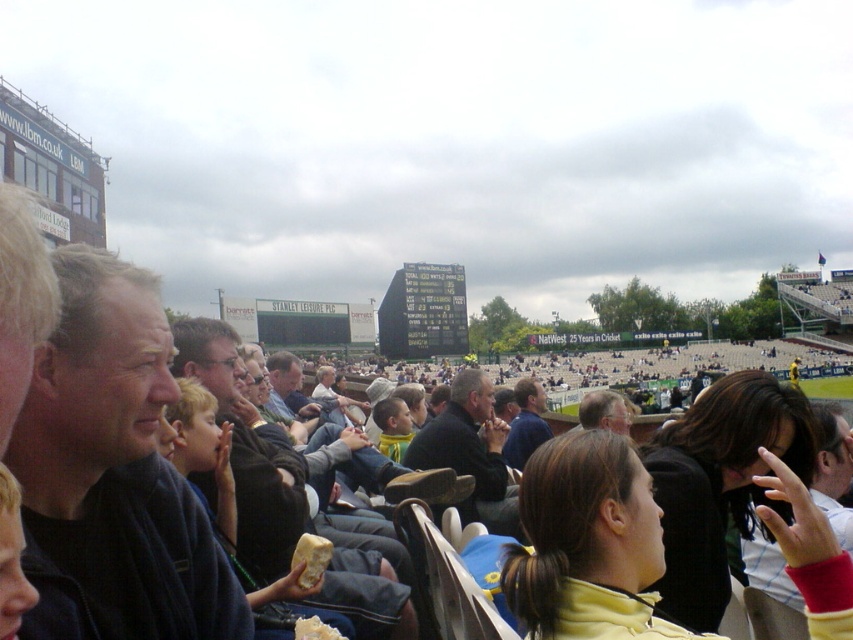
Question: Is matte black jacket at center in front of yellow crumbly food at center?

Choices:
 (A) no
 (B) yes

Answer: (A)

Question: Which point is farther from the camera taking this photo?

Choices:
 (A) (90, 628)
 (B) (753, 419)

Answer: (B)

Question: Where is dark blue fleece at center located in relation to matte black jacket at center in the image?

Choices:
 (A) right
 (B) left

Answer: (B)

Question: Based on their relative distances, which object is farther from the dark blue fleece at center?

Choices:
 (A) dark brown hair at center
 (B) dark blue sweater at center
 (C) yellow crumbly food at center
 (D) dark brown leather jacket at center

Answer: (A)

Question: From the image, what is the correct spatial relationship of matte black jacket at center in relation to yellow crumbly food at center?

Choices:
 (A) left
 (B) right

Answer: (B)

Question: Among these points, which one is farthest from the camera?

Choices:
 (A) (529, 445)
 (B) (84, 508)
 (C) (607, 392)

Answer: (A)